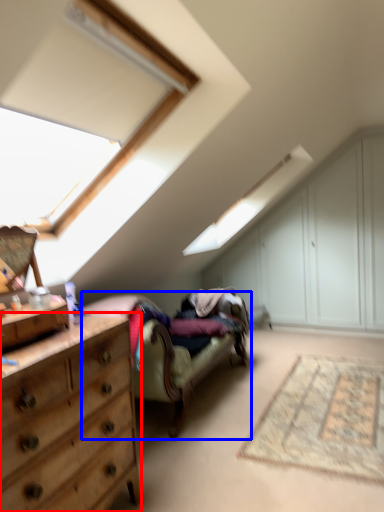
Question: Which object appears closest to the camera in this image, chest of drawers (highlighted by a red box) or studio couch (highlighted by a blue box)?

Choices:
 (A) chest of drawers
 (B) studio couch

Answer: (A)